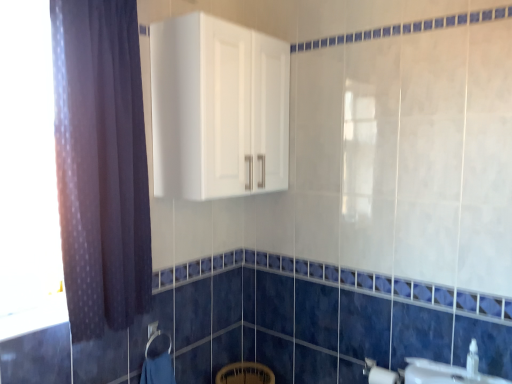
Locate an element on the screen. white plastic soap dispenser at lower right is located at coordinates (473, 361).

This screenshot has width=512, height=384. What do you see at coordinates (473, 361) in the screenshot? I see `white plastic soap dispenser at lower right` at bounding box center [473, 361].

The height and width of the screenshot is (384, 512). I want to click on white glossy sink at lower right, so click(x=448, y=371).

Measure the distance between point (511, 383) and camera.

Point (511, 383) is 1.54 meters from camera.

Locate an element on the screen. transparent glass window at left is located at coordinates (28, 173).

What is the approximate width of transparent glass window at left?

6.74 centimeters.

What do you see at coordinates (158, 364) in the screenshot? I see `blue soft towel at lower center` at bounding box center [158, 364].

Locate an element on the screen. This screenshot has width=512, height=384. white plastic soap dispenser at lower right is located at coordinates (473, 361).

You are a GUI agent. You are given a task and a screenshot of the screen. Output one action in this format:
    pyautogui.click(x=<x>, y=<y>)
    Task: Click on the window lying in front of the white plastic soap dispenser at lower right
    This screenshot has width=512, height=384.
    Given the screenshot: What is the action you would take?
    pyautogui.click(x=28, y=173)

Can you tell me how much white plastic soap dispenser at lower right and transparent glass window at left differ in facing direction?

They differ by 88.5 degrees in their facing directions.

Is the surface of white plastic soap dispenser at lower right in direct contact with transparent glass window at left?

No, white plastic soap dispenser at lower right is not making contact with transparent glass window at left.

How distant is white plastic soap dispenser at lower right from transparent glass window at left?

The distance of white plastic soap dispenser at lower right from transparent glass window at left is 1.85 meters.

Can you confirm if blue soft towel at lower center is shorter than white glossy cabinet at upper center?

Indeed, blue soft towel at lower center has a lesser height compared to white glossy cabinet at upper center.

Is blue soft towel at lower center far from white glossy cabinet at upper center?

Yes, blue soft towel at lower center is far from white glossy cabinet at upper center.

Between point (169, 353) and point (212, 22), which one is positioned behind?

The point (169, 353) is more distant.

Is the position of blue soft towel at lower center more distant than that of white glossy cabinet at upper center?

Yes, it is.

From the picture: Can you tell me how much dark purple fabric at left and blue soft towel at lower center differ in facing direction?

There is a 0.644-degree angle between the facing directions of dark purple fabric at left and blue soft towel at lower center.

Considering their positions, is dark purple fabric at left located in front of or behind blue soft towel at lower center?

dark purple fabric at left is in front of blue soft towel at lower center.

In the image, is dark purple fabric at left on the left side or the right side of blue soft towel at lower center?

Clearly, dark purple fabric at left is on the left of blue soft towel at lower center in the image.

Considering the positions of points (17, 271) and (166, 366), is point (17, 271) closer to camera compared to point (166, 366)?

Yes, point (17, 271) is closer to viewer.

Which object is further away from the camera, transparent glass window at left or blue soft towel at lower center?

blue soft towel at lower center.

Considering the relative sizes of transparent glass window at left and blue soft towel at lower center in the image provided, is transparent glass window at left thinner than blue soft towel at lower center?

Yes, transparent glass window at left is thinner than blue soft towel at lower center.

Does white glossy cabinet at upper center touch transparent glass window at left?

No, white glossy cabinet at upper center is not with transparent glass window at left.

Considering the relative sizes of white glossy cabinet at upper center and transparent glass window at left in the image provided, is white glossy cabinet at upper center thinner than transparent glass window at left?

No, white glossy cabinet at upper center is not thinner than transparent glass window at left.

Which is behind, point (251, 98) or point (6, 78)?

Positioned behind is point (251, 98).

Could you tell me if white glossy cabinet at upper center is facing transparent glass window at left?

No, white glossy cabinet at upper center is not facing towards transparent glass window at left.

Considering the sizes of objects white glossy sink at lower right and transparent glass window at left in the image provided, who is bigger, white glossy sink at lower right or transparent glass window at left?

transparent glass window at left.

Is white glossy sink at lower right wider than transparent glass window at left?

No.

Is white glossy sink at lower right positioned with its back to transparent glass window at left?

That's not correct — white glossy sink at lower right is not looking away from transparent glass window at left.

Is white glossy sink at lower right positioned beyond the bounds of transparent glass window at left?

Yes, white glossy sink at lower right is not within transparent glass window at left.

Considering the relative sizes of dark purple fabric at left and white glossy cabinet at upper center in the image provided, is dark purple fabric at left smaller than white glossy cabinet at upper center?

Yes, dark purple fabric at left is smaller than white glossy cabinet at upper center.

Between dark purple fabric at left and white glossy cabinet at upper center, which one is positioned behind?

white glossy cabinet at upper center is further from the camera.

Is dark purple fabric at left spatially inside white glossy cabinet at upper center, or outside of it?

The correct answer is: outside.

From the image's perspective, which one is positioned lower, dark purple fabric at left or white glossy cabinet at upper center?

From the image's view, dark purple fabric at left is below.

I want to click on plumbing fixture on the right side of transparent glass window at left, so click(x=473, y=361).

Where is `bath towel below the white glossy cabinet at upper center (from the image's perspective)`? The height and width of the screenshot is (384, 512). bath towel below the white glossy cabinet at upper center (from the image's perspective) is located at coordinates (158, 364).

From the image, which object appears to be farther from white plastic soap dispenser at lower right, white glossy sink at lower right or dark purple fabric at left?

dark purple fabric at left lies further to white plastic soap dispenser at lower right than the other object.

Consider the image. Based on their spatial positions, is white glossy cabinet at upper center or white plastic soap dispenser at lower right further from white matte toilet paper at lower right?

white glossy cabinet at upper center is positioned further to the anchor white matte toilet paper at lower right.

Estimate the real-world distances between objects in this image. Which object is further from white glossy cabinet at upper center, blue soft towel at lower center or white matte toilet paper at lower right?

Based on the image, white matte toilet paper at lower right appears to be further to white glossy cabinet at upper center.

Based on their spatial positions, is blue soft towel at lower center or white plastic soap dispenser at lower right closer to white glossy cabinet at upper center?

The object closer to white glossy cabinet at upper center is blue soft towel at lower center.

Based on their spatial positions, is white glossy cabinet at upper center or white matte toilet paper at lower right closer to blue soft towel at lower center?

The object closer to blue soft towel at lower center is white matte toilet paper at lower right.

Looking at the image, which one is located further to white plastic soap dispenser at lower right, transparent glass window at left or dark purple fabric at left?

The object further to white plastic soap dispenser at lower right is transparent glass window at left.

From the picture: Estimate the real-world distances between objects in this image. Which object is further from white glossy cabinet at upper center, transparent glass window at left or blue soft towel at lower center?

The object further to white glossy cabinet at upper center is blue soft towel at lower center.

Looking at the image, which one is located further to dark purple fabric at left, white glossy cabinet at upper center or white matte toilet paper at lower right?

Based on the image, white matte toilet paper at lower right appears to be further to dark purple fabric at left.

Find the location of a particular element. The image size is (512, 384). sink between white plastic soap dispenser at lower right and white matte toilet paper at lower right in the up-down direction is located at coordinates (448, 371).

Identify the location of curtain between transparent glass window at left and white plastic soap dispenser at lower right. This screenshot has width=512, height=384. (101, 164).

Locate an element on the screen. The height and width of the screenshot is (384, 512). curtain between transparent glass window at left and blue soft towel at lower center from top to bottom is located at coordinates (101, 164).

Find the location of a particular element. cabinetry between transparent glass window at left and white matte toilet paper at lower right in the horizontal direction is located at coordinates (218, 109).